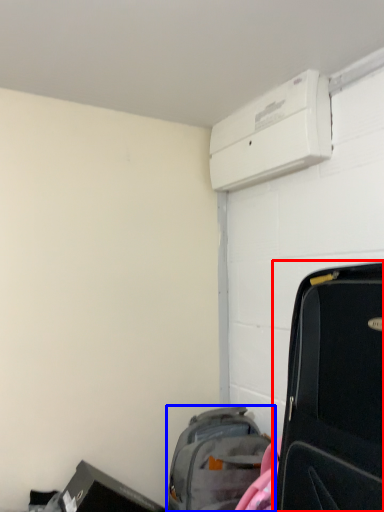
Question: Which of the following is the closest to the observer, suitcase (highlighted by a red box) or luggage and bags (highlighted by a blue box)?

Choices:
 (A) suitcase
 (B) luggage and bags

Answer: (A)